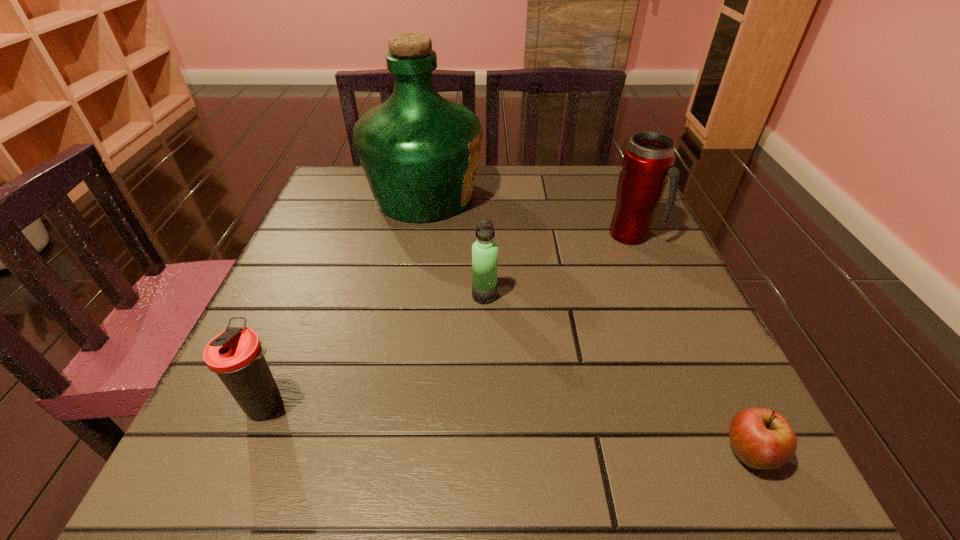
The height and width of the screenshot is (540, 960). Find the location of `object that is at the near right corner`. object that is at the near right corner is located at coordinates (761, 438).

At what (x,y) coordinates should I click in order to perform the action: click on free space at the far edge of the desktop. Please return your answer as a coordinate pair (x, y). Looking at the image, I should click on (481, 166).

The width and height of the screenshot is (960, 540). In the image, there is a desktop. In order to click on vacant space at the near edge in this screenshot , I will do `click(327, 448)`.

The height and width of the screenshot is (540, 960). I want to click on vacant space at the left edge of the desktop, so click(298, 289).

Locate an element on the screen. vacant area at the right edge of the desktop is located at coordinates (733, 389).

The width and height of the screenshot is (960, 540). What are the coordinates of `vacant space at the far left corner of the desktop` in the screenshot? It's located at (338, 171).

The image size is (960, 540). What are the coordinates of `empty location between the leftmost thermos bottle and the farthest thermos bottle` in the screenshot? It's located at (449, 320).

Identify the location of unoccupied area between the leftmost thermos bottle and the nearest object. The height and width of the screenshot is (540, 960). (508, 430).

In order to click on free space between the apple and the farthest thermos bottle in this screenshot , I will do `click(689, 345)`.

Locate an element on the screen. unoccupied area between the farthest thermos bottle and the tallest object is located at coordinates (528, 215).